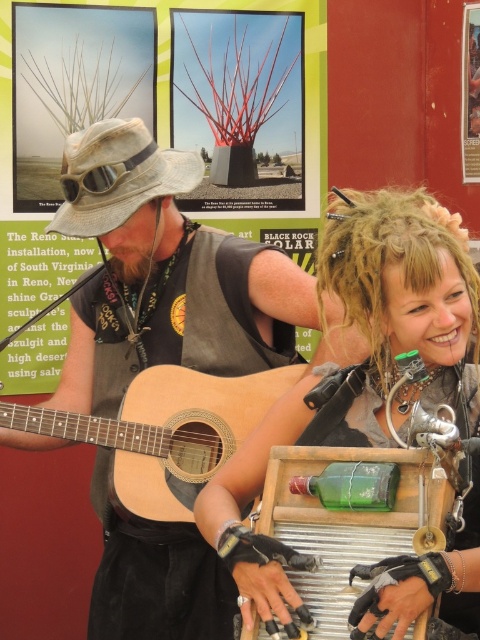
You are a photographer setting up for a shoot. You have a green glass bottle at center and a brushed metal poster at upper center in your frame. Which object should you focus on if you want to capture the larger object in your shot?

The green glass bottle at center is larger in size than the brushed metal poster at upper center, so you should focus on the green glass bottle at center to capture the larger object.